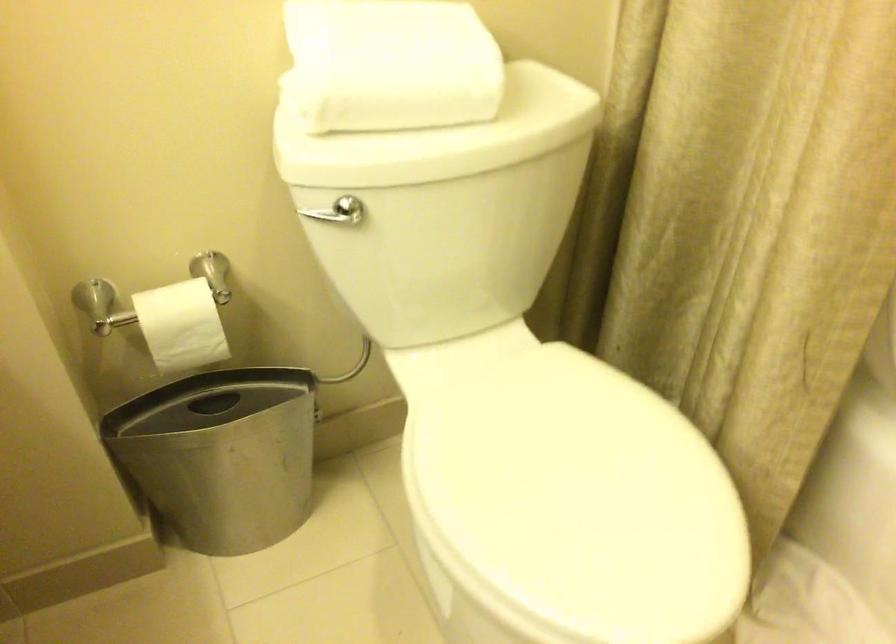
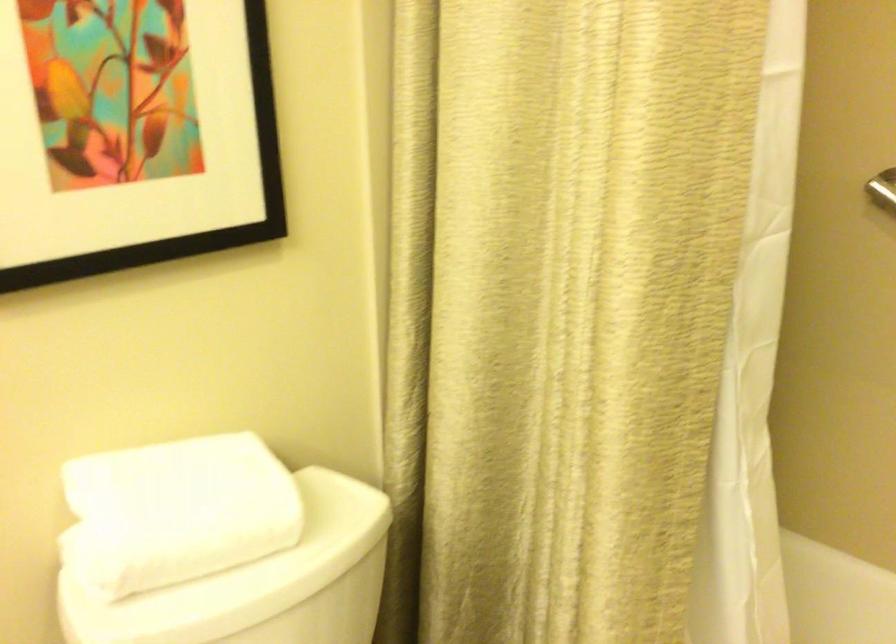
Looking at this image, in a continuous first-person perspective shot, in which direction is the camera moving?

The cameraman walked toward left, backward.